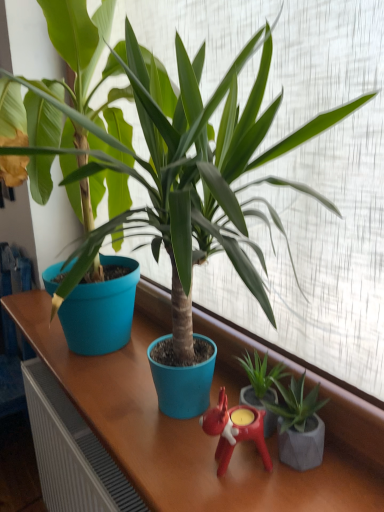
Question: From a real-world perspective, is rubberized red candle holder at center above or below matte blue pot at center, which ranks as the first houseplant in left-to-right order?

Choices:
 (A) below
 (B) above

Answer: (A)

Question: Would you say rubberized red candle holder at center is inside or outside matte blue pot at center, which ranks as the first houseplant in left-to-right order?

Choices:
 (A) outside
 (B) inside

Answer: (A)

Question: Which is farther from the matte blue pot at center, the third houseplant viewed from the right?

Choices:
 (A) green matte plant at center, which is counted as the second houseplant, starting from the left
 (B) green matte plant at lower right, which appears as the third houseplant when viewed from the left
 (C) rubberized red candle holder at center

Answer: (B)

Question: Considering the real-world distances, which object is closest to the green matte plant at center, the 2th houseplant in the right-to-left sequence?

Choices:
 (A) matte blue pot at center, which ranks as the first houseplant in left-to-right order
 (B) rubberized red candle holder at center
 (C) green matte plant at lower right, which appears as the third houseplant when viewed from the left

Answer: (C)